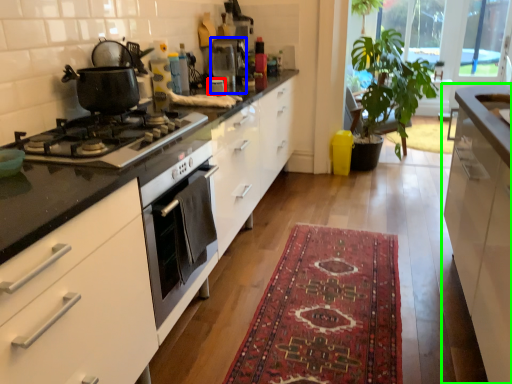
Question: Estimate the real-world distances between objects in this image. Which object is closer to appliance (highlighted by a red box), coffee machine (highlighted by a blue box) or cabinetry (highlighted by a green box)?

Choices:
 (A) coffee machine
 (B) cabinetry

Answer: (A)